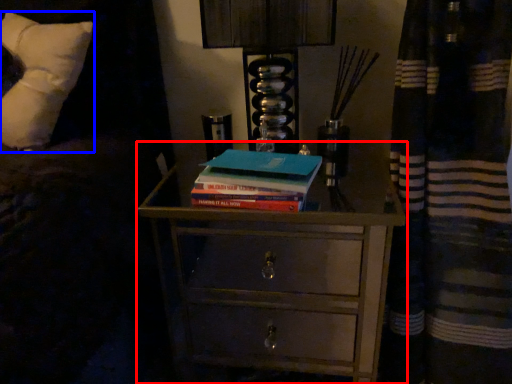
Question: Which object appears farthest to the camera in this image, chest of drawers (highlighted by a red box) or pillow (highlighted by a blue box)?

Choices:
 (A) chest of drawers
 (B) pillow

Answer: (A)